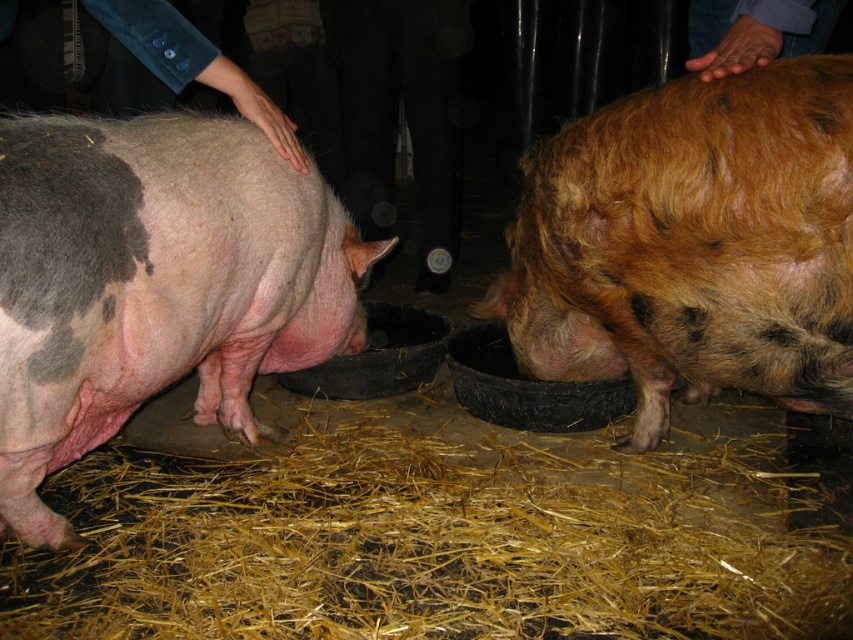
Question: Which object is farther from the camera taking this photo?

Choices:
 (A) speckled pink pig at left
 (B) brown fuzzy pig at center

Answer: (B)

Question: Which object appears closest to the camera in this image?

Choices:
 (A) brown fuzzy pig at center
 (B) speckled pink pig at left
 (C) yellow straw at lower center

Answer: (B)

Question: From the image, what is the correct spatial relationship of speckled pink pig at left in relation to brown fuzzy pig at center?

Choices:
 (A) right
 (B) left

Answer: (B)

Question: Which object is closer to the camera taking this photo?

Choices:
 (A) yellow straw at lower center
 (B) brown fuzzy pig at center

Answer: (A)

Question: Does yellow straw at lower center have a lesser width compared to brown fuzzy pig at center?

Choices:
 (A) no
 (B) yes

Answer: (A)

Question: Observing the image, what is the correct spatial positioning of yellow straw at lower center in reference to speckled pink pig at left?

Choices:
 (A) above
 (B) below

Answer: (B)